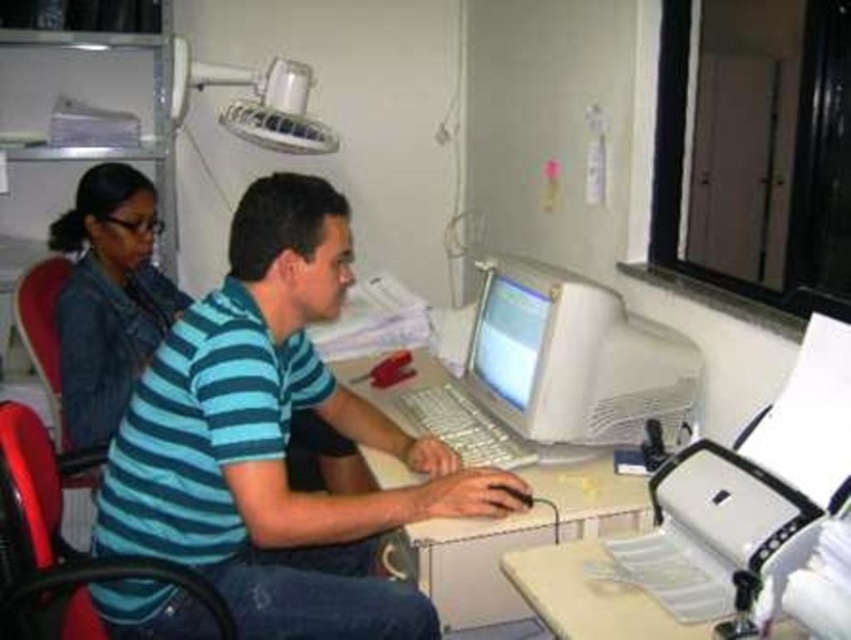
Question: Does red plastic swivel chair at left lie behind matte plastic monitor at center?

Choices:
 (A) no
 (B) yes

Answer: (A)

Question: Among these points, which one is nearest to the camera?

Choices:
 (A) (518, 284)
 (B) (454, 548)

Answer: (B)

Question: Can you confirm if denim jacket at left is positioned to the right of red plastic swivel chair at left?

Choices:
 (A) yes
 (B) no

Answer: (B)

Question: Is red plastic swivel chair at left smaller than matte plastic monitor at center?

Choices:
 (A) yes
 (B) no

Answer: (B)

Question: Considering the real-world distances, which object is closest to the denim jacket at left?

Choices:
 (A) white plastic computer desk at center
 (B) white plastic monitor at center
 (C) red plastic swivel chair at left

Answer: (C)

Question: Which point is closer to the camera?

Choices:
 (A) white plastic computer desk at center
 (B) blue striped shirt at center
 (C) denim jacket at left
 (D) red plastic swivel chair at left

Answer: (D)